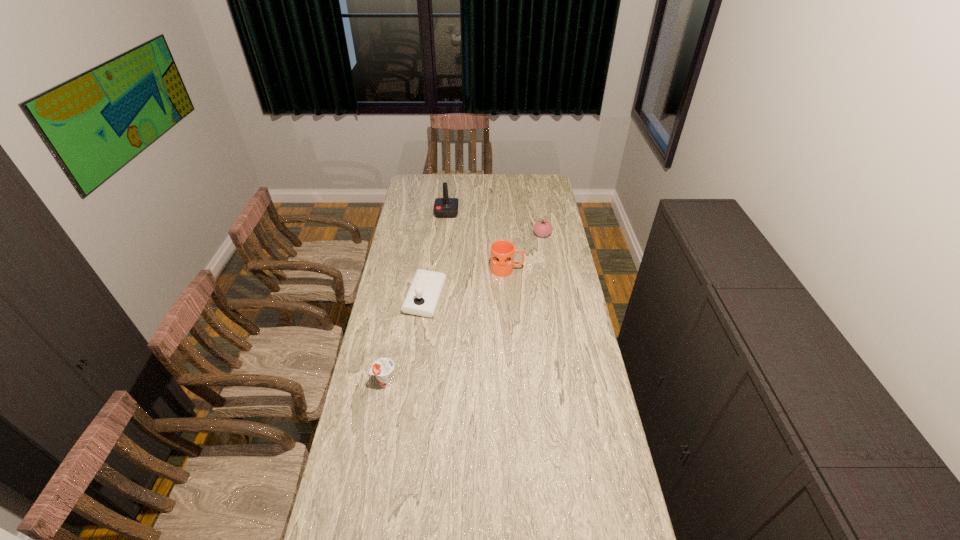
You are a GUI agent. You are given a task and a screenshot of the screen. Output one action in this format:
    pyautogui.click(x=<x>, y=<y>)
    Task: Click on the vacant space at the far left corner of the desktop
    
    Given the screenshot: What is the action you would take?
    pyautogui.click(x=431, y=176)

The height and width of the screenshot is (540, 960). What are the coordinates of `vacant point located between the fourth farthest object and the farthest object` in the screenshot? It's located at (436, 255).

The width and height of the screenshot is (960, 540). Identify the location of vacant area that lies between the third farthest object and the second farthest object. (524, 252).

At what (x,y) coordinates should I click in order to perform the action: click on empty location between the second object from right to left and the tomato. Please return your answer as a coordinate pair (x, y). Looking at the image, I should click on (524, 252).

Where is `vacant region between the fourth nearest object and the tallest object`? vacant region between the fourth nearest object and the tallest object is located at coordinates (494, 224).

The height and width of the screenshot is (540, 960). In order to click on free spot between the fourth farthest object and the nearest object in this screenshot , I will do `click(405, 339)`.

Where is `free space between the nearer joystick and the yogurt`? The image size is (960, 540). free space between the nearer joystick and the yogurt is located at coordinates (405, 339).

At what (x,y) coordinates should I click in order to perform the action: click on vacant space that is in between the mug and the shorter joystick. Please return your answer as a coordinate pair (x, y). The image size is (960, 540). Looking at the image, I should click on (466, 284).

Where is `free area in between the second object from right to left and the taller joystick`? The width and height of the screenshot is (960, 540). free area in between the second object from right to left and the taller joystick is located at coordinates (477, 241).

Point out which object is positioned as the third nearest to the nearest object. Please provide its 2D coordinates. Your answer should be formatted as a tuple, i.e. [(x, y)], where the tuple contains the x and y coordinates of a point satisfying the conditions above.

[(542, 228)]